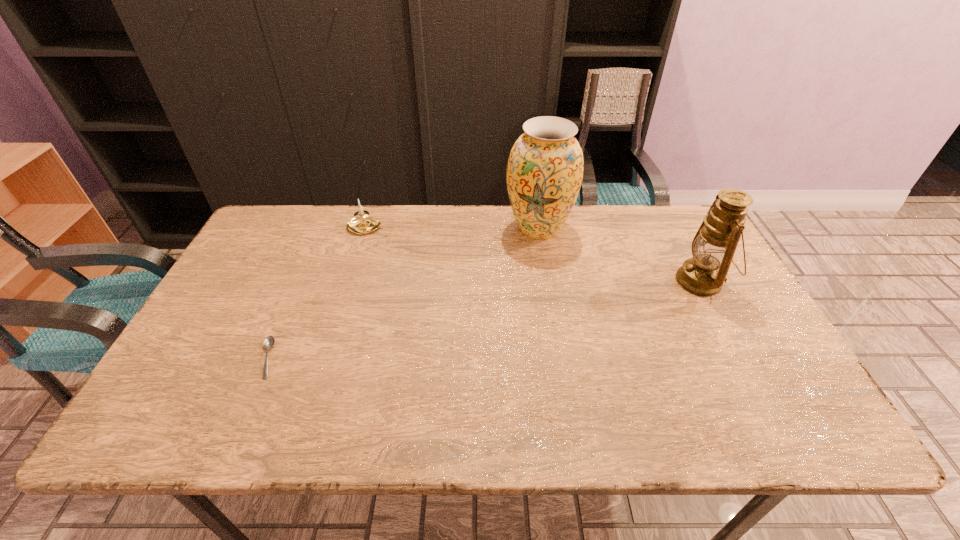
Identify the location of free space located 0.200m on the back of the shortest object. The width and height of the screenshot is (960, 540). (300, 283).

This screenshot has height=540, width=960. Find the location of `vase that is positioned at the far edge`. vase that is positioned at the far edge is located at coordinates (544, 174).

Find the location of a particular element. This screenshot has width=960, height=540. candle holder situated at the far edge is located at coordinates (361, 224).

You are a GUI agent. You are given a task and a screenshot of the screen. Output one action in this format:
    pyautogui.click(x=<x>, y=<y>)
    Task: Click on the object that is at the right edge
    The height and width of the screenshot is (540, 960).
    Given the screenshot: What is the action you would take?
    pyautogui.click(x=713, y=247)

In the image, there is a desktop. Identify the location of free space at the far edge. (429, 212).

Where is `vacant region at the near edge of the desktop`? The height and width of the screenshot is (540, 960). vacant region at the near edge of the desktop is located at coordinates (299, 424).

Where is `free space at the left edge of the desktop`? The height and width of the screenshot is (540, 960). free space at the left edge of the desktop is located at coordinates [258, 293].

This screenshot has width=960, height=540. Identify the location of vacant space at the right edge. (779, 355).

Locate an element on the screen. The image size is (960, 540). free space at the near left corner of the desktop is located at coordinates (179, 433).

Where is `free space between the second object from left to right and the second object from right to left`? The width and height of the screenshot is (960, 540). free space between the second object from left to right and the second object from right to left is located at coordinates coord(452,228).